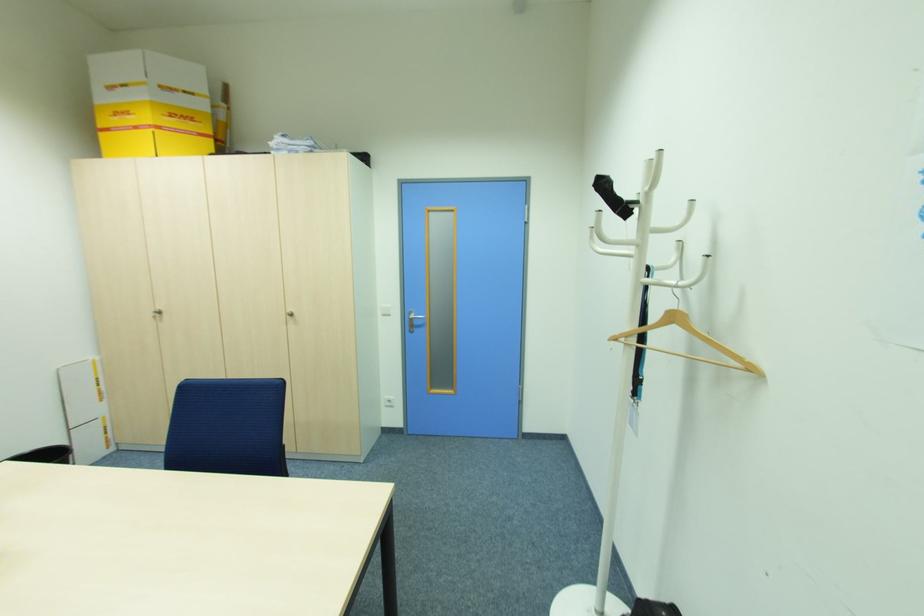
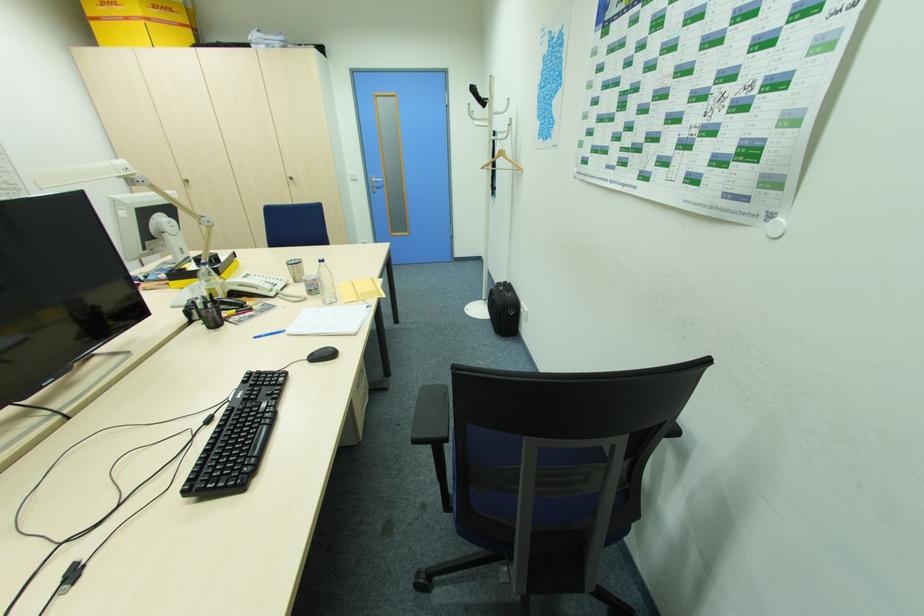
Where in the second image is the point corresponding to pixel 617 339 from the first image?

(485, 168)